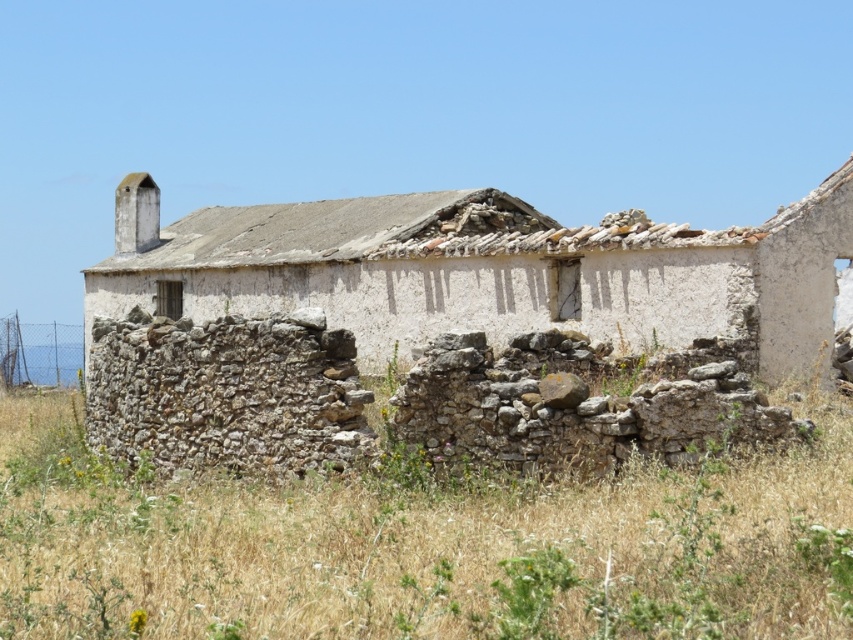
Is dry grass at lower center in front of white stucco wall at center?

Yes, dry grass at lower center is in front of white stucco wall at center.

Find the location of a particular element. The width and height of the screenshot is (853, 640). dry grass at lower center is located at coordinates (421, 547).

Where is `dry grass at lower center`? The image size is (853, 640). dry grass at lower center is located at coordinates tap(421, 547).